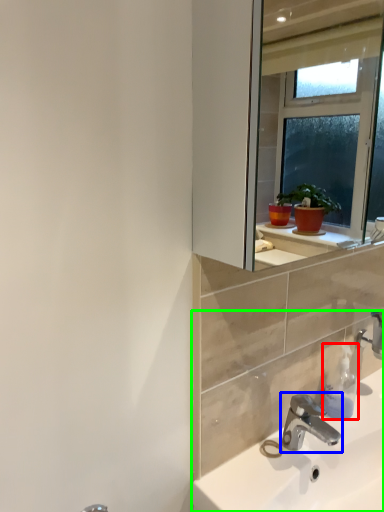
Question: Based on their relative distances, which object is farther from soap dispenser (highlighted by a red box)? Choose from tap (highlighted by a blue box) and sink (highlighted by a green box).

Choices:
 (A) tap
 (B) sink

Answer: (B)